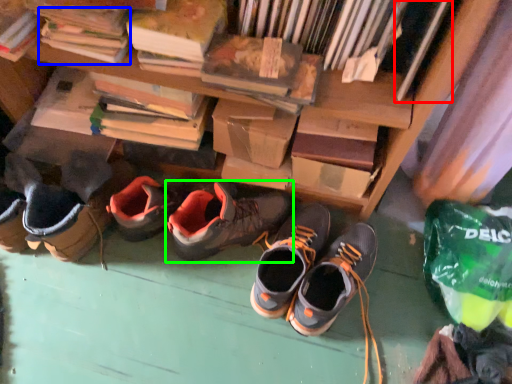
Question: Which object is the farthest from book (highlighted by a red box)? Choose among these: book (highlighted by a blue box) or footwear (highlighted by a green box).

Choices:
 (A) book
 (B) footwear

Answer: (A)